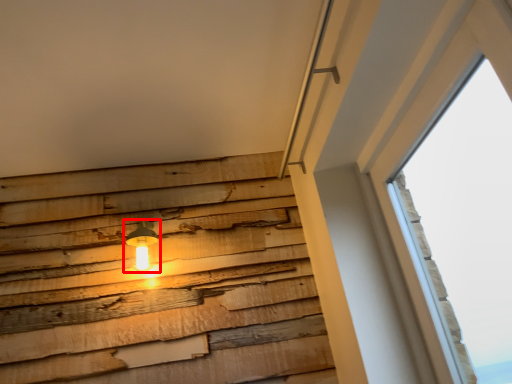
Question: From the image, what is the correct spatial relationship of lamp (annotated by the red box) in relation to window?

Choices:
 (A) left
 (B) right

Answer: (A)